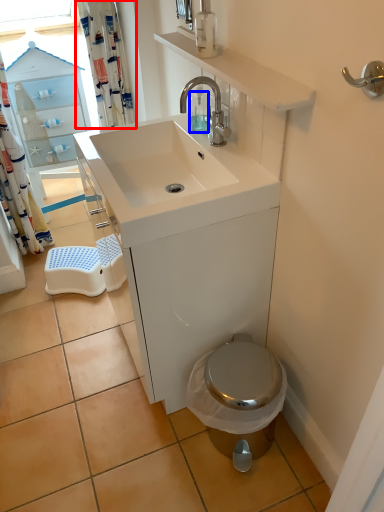
Question: Which object appears farthest to the camera in this image, shower curtain (highlighted by a red box) or soap dispenser (highlighted by a blue box)?

Choices:
 (A) shower curtain
 (B) soap dispenser

Answer: (A)